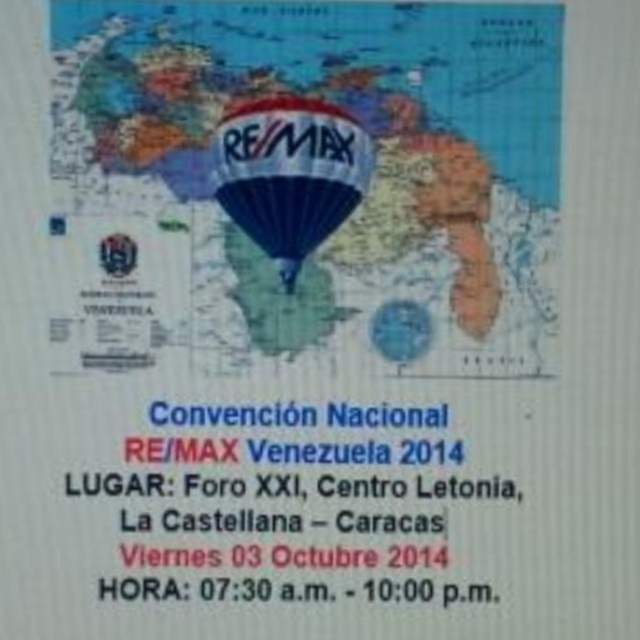
Question: Can you confirm if map at center is positioned below blue glossy balloon at center?

Choices:
 (A) yes
 (B) no

Answer: (B)

Question: Is map at center bigger than blue glossy balloon at center?

Choices:
 (A) yes
 (B) no

Answer: (A)

Question: Which point is closer to the camera?

Choices:
 (A) (225, 148)
 (B) (417, 340)

Answer: (A)

Question: Does map at center come in front of blue glossy balloon at center?

Choices:
 (A) no
 (B) yes

Answer: (B)